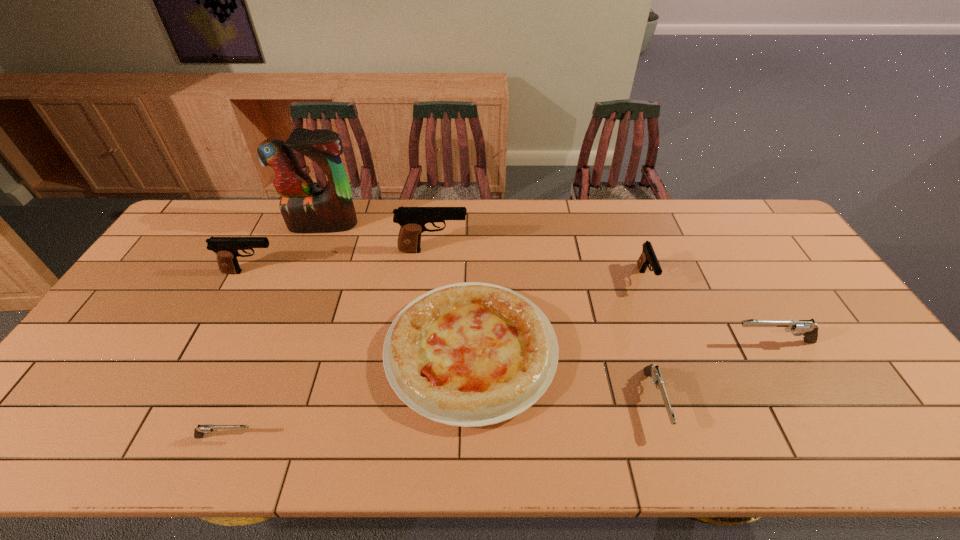
Where is `pizza`? pizza is located at coordinates (470, 354).

The width and height of the screenshot is (960, 540). What are the coordinates of `the fourth pistol from left to right` in the screenshot? It's located at (651, 370).

The image size is (960, 540). I want to click on the second biggest silver pistol, so click(651, 370).

Where is `the shortest pistol`? This screenshot has height=540, width=960. the shortest pistol is located at coordinates (199, 431).

The image size is (960, 540). What are the coordinates of `the leftmost silver pistol` in the screenshot? It's located at (x=199, y=431).

Locate an element on the screen. This screenshot has width=960, height=540. free region located at the face of the parrot is located at coordinates (292, 301).

The height and width of the screenshot is (540, 960). Identify the location of free space located at the barrel of the seventh shortest object. (590, 251).

Where is `free location located at the barrel of the fifth shortest pistol`? free location located at the barrel of the fifth shortest pistol is located at coordinates (390, 272).

Where is `vacant space located 0.200m at the barrel of the seventh object from left to right`? The width and height of the screenshot is (960, 540). vacant space located 0.200m at the barrel of the seventh object from left to right is located at coordinates (671, 351).

Locate an element on the screen. The image size is (960, 540). vacant space located 0.180m on the front-facing side of the fourth farthest pistol is located at coordinates (663, 342).